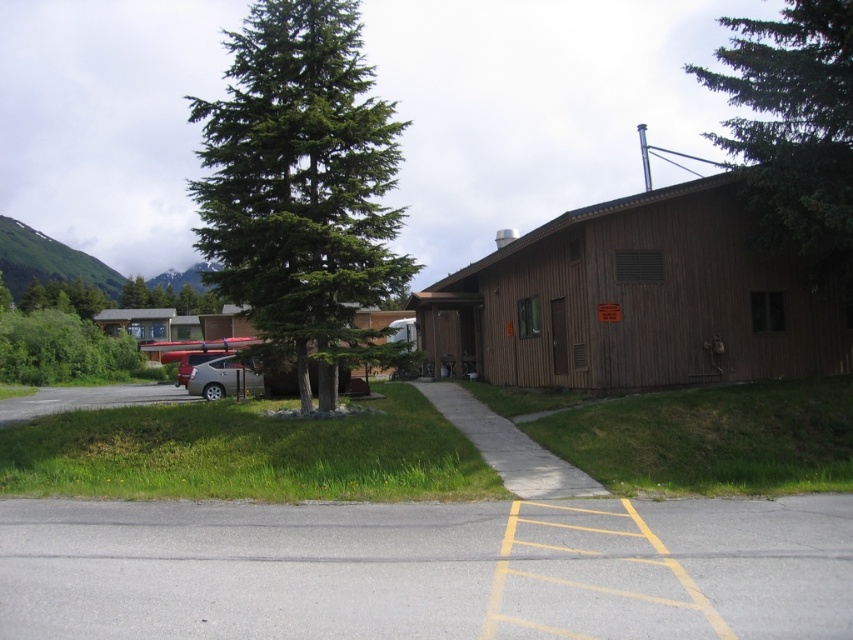
You are standing in front of the wooden building and want to take a photo. There are two points marked in the scene, point 1 at coordinates point (827,516) and point 2 at coordinates point (178,372). Which point is closer to you when you are facing the building?

Point (827,516) is closer to the camera than point (178,372), so when facing the building, point (827,516) would be closer to you.